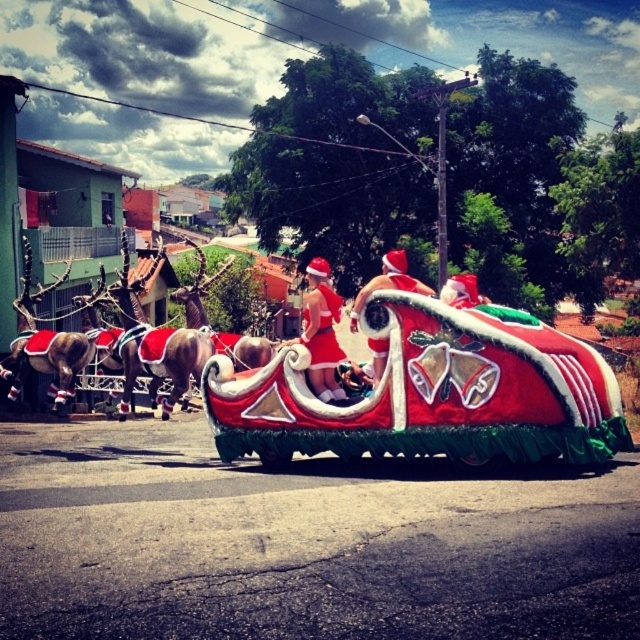
Question: Which point is closer to the camera?

Choices:
 (A) red velvet dress at center
 (B) red velvet santa hat at center
 (C) shiny red fabric wagon at center

Answer: (C)

Question: Which of the following is the farthest from the observer?

Choices:
 (A) [x=369, y=282]
 (B) [x=257, y=432]

Answer: (A)

Question: Is shiny red fabric wagon at center positioned in front of red velvet dress at center?

Choices:
 (A) no
 (B) yes

Answer: (B)

Question: Is shiny red fabric wagon at center in front of red velvet santa hat at center?

Choices:
 (A) no
 (B) yes

Answer: (B)

Question: Among these points, which one is farthest from the camera?

Choices:
 (A) pos(308,316)
 (B) pos(252,412)
 (C) pos(372,369)

Answer: (B)

Question: Can you confirm if shiny red fabric wagon at center is positioned below red velvet santa hat at center?

Choices:
 (A) no
 (B) yes

Answer: (B)